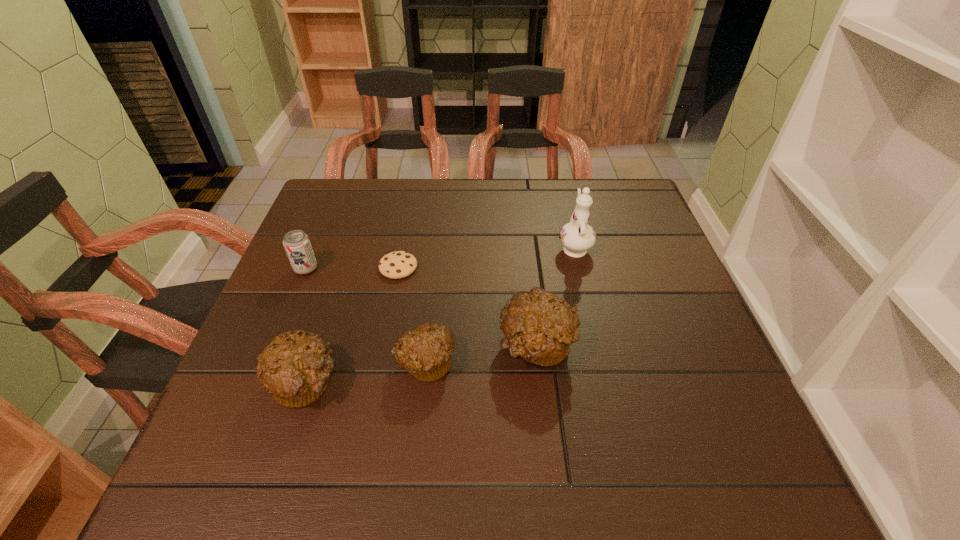
At what (x,y) coordinates should I click in order to perform the action: click on the second tallest muffin. Please return your answer as a coordinate pair (x, y). The height and width of the screenshot is (540, 960). Looking at the image, I should click on coord(295,368).

This screenshot has height=540, width=960. I want to click on the shortest muffin, so click(x=425, y=351).

Locate an element on the screen. The height and width of the screenshot is (540, 960). the second muffin from left to right is located at coordinates (425, 351).

Where is `the rightmost muffin`? This screenshot has width=960, height=540. the rightmost muffin is located at coordinates (539, 327).

Where is `beer can`? This screenshot has height=540, width=960. beer can is located at coordinates (297, 245).

I want to click on the tallest object, so click(x=577, y=237).

Where is `the rightmost object`? the rightmost object is located at coordinates (577, 237).

What are the coordinates of `the shortest object` in the screenshot? It's located at (395, 265).

Where is `vacant space located on the right of the second shortest muffin`? Image resolution: width=960 pixels, height=540 pixels. vacant space located on the right of the second shortest muffin is located at coordinates (404, 382).

Find the location of a particular element. Image resolution: width=960 pixels, height=540 pixels. free space located on the right of the second muffin from left to right is located at coordinates click(545, 363).